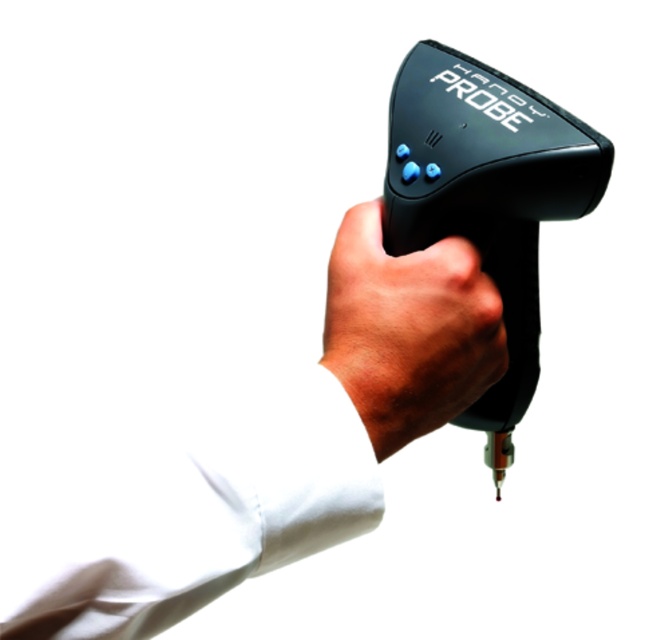
You are an engineer inspecting two probes. The black matte probe at center and the black rubber probe at center are both on a table in front of you. Which probe has a greater width?

The black matte probe at center has a greater width than the black rubber probe at center according to the description.